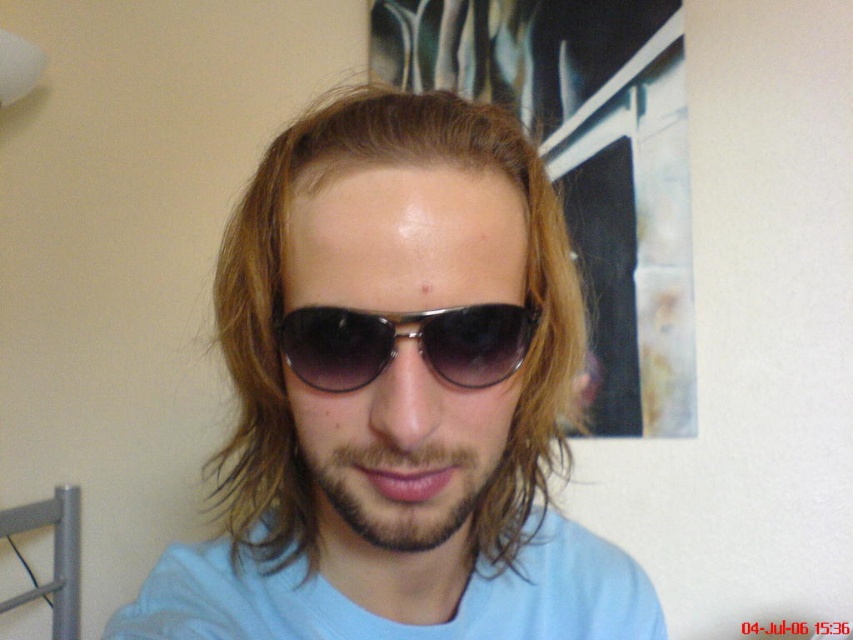
You are a photographer analyzing this image. You need to determine which facial feature occupies more horizontal space between the brown matte hair at center and the dark brown stubble at center. Which one is wider?

The brown matte hair at center is wider than the dark brown stubble at center, as its width surpasses that of the stubble.

In the scene shown: You are a photographer setting up a portrait shoot. You need to ensure that the light blue cotton shirt at center is visible above the black metallic sunglasses at center in the final image. Based on the scene description, will this arrangement naturally occur without any adjustments?

The light blue cotton shirt at center has a greater height compared to the black metallic sunglasses at center, so yes, the light blue cotton shirt at center will naturally appear above the black metallic sunglasses at center in the image without needing adjustments.